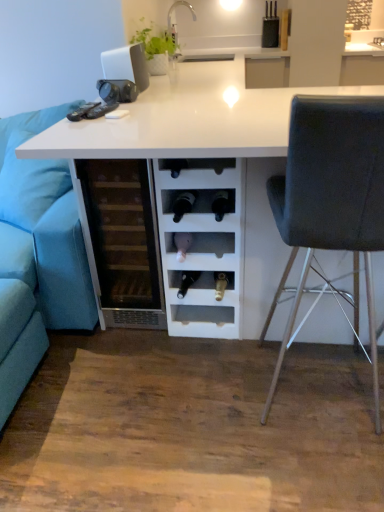
Question: Is blue fabric couch at left shorter than white glossy table at center?

Choices:
 (A) no
 (B) yes

Answer: (B)

Question: Is blue fabric couch at left far away from white glossy table at center?

Choices:
 (A) no
 (B) yes

Answer: (A)

Question: Is blue fabric couch at left oriented towards white glossy table at center?

Choices:
 (A) yes
 (B) no

Answer: (B)

Question: Is blue fabric couch at left completely or partially outside of white glossy table at center?

Choices:
 (A) no
 (B) yes

Answer: (B)

Question: Is white glossy table at center a part of blue fabric couch at left?

Choices:
 (A) yes
 (B) no

Answer: (B)

Question: Is blue fabric couch at left closer to camera compared to white glossy table at center?

Choices:
 (A) yes
 (B) no

Answer: (A)

Question: Can you confirm if white matte laptop at upper center is positioned to the left of blue fabric couch at left?

Choices:
 (A) no
 (B) yes

Answer: (A)

Question: Could you tell me if white matte laptop at upper center is facing blue fabric couch at left?

Choices:
 (A) no
 (B) yes

Answer: (A)

Question: Does white matte laptop at upper center have a larger size compared to blue fabric couch at left?

Choices:
 (A) yes
 (B) no

Answer: (B)

Question: Is blue fabric couch at left at the back of white matte laptop at upper center?

Choices:
 (A) yes
 (B) no

Answer: (B)

Question: Is white matte laptop at upper center surrounding blue fabric couch at left?

Choices:
 (A) yes
 (B) no

Answer: (B)

Question: From a real-world perspective, is white matte laptop at upper center over blue fabric couch at left?

Choices:
 (A) yes
 (B) no

Answer: (A)

Question: Does white glossy table at center have a lesser height compared to transparent glass wine cooler at center?

Choices:
 (A) no
 (B) yes

Answer: (A)